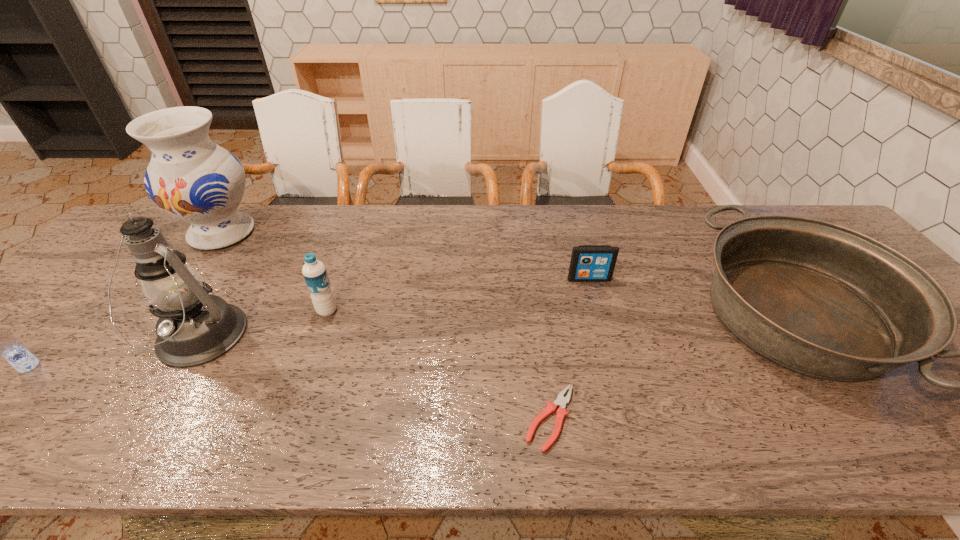
You are a GUI agent. You are given a task and a screenshot of the screen. Output one action in this format:
    pyautogui.click(x=<x>, y=<y>)
    Task: Click on the vase
    The image size is (960, 540).
    Given the screenshot: What is the action you would take?
    pyautogui.click(x=190, y=177)

Identify the location of oil lamp. (194, 327).

What are the coordinates of `the fourth object from right to left` in the screenshot? It's located at (314, 272).

The width and height of the screenshot is (960, 540). What are the coordinates of `vodka` in the screenshot? It's located at (0, 341).

At what (x,y) coordinates should I click in order to perform the action: click on the second shortest object. Please return your answer as a coordinate pair (x, y). Looking at the image, I should click on (589, 263).

At what (x,y) coordinates should I click in order to perform the action: click on iPod. Please return your answer as a coordinate pair (x, y). Looking at the image, I should click on (589, 263).

Identify the location of the shortest object. (561, 401).

The width and height of the screenshot is (960, 540). Identify the location of pliers. (561, 401).

Locate an element on the screen. This screenshot has height=540, width=960. vacant space located 0.260m on the front of the vase is located at coordinates (155, 325).

At what (x,y) coordinates should I click in order to perform the action: click on vacant space located 0.340m on the back of the oil lamp. Please return your answer as a coordinate pair (x, y). This screenshot has height=540, width=960. Looking at the image, I should click on (266, 228).